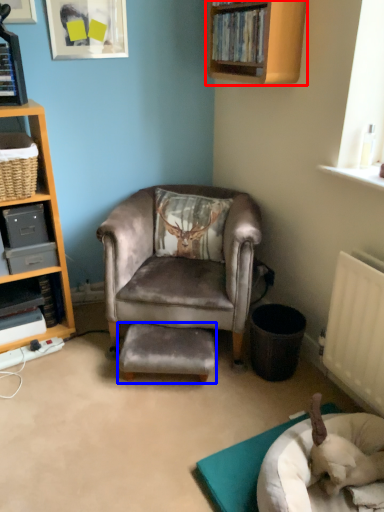
Question: Which point is further to the camera, shelf (highlighted by a red box) or stool (highlighted by a blue box)?

Choices:
 (A) shelf
 (B) stool

Answer: (B)